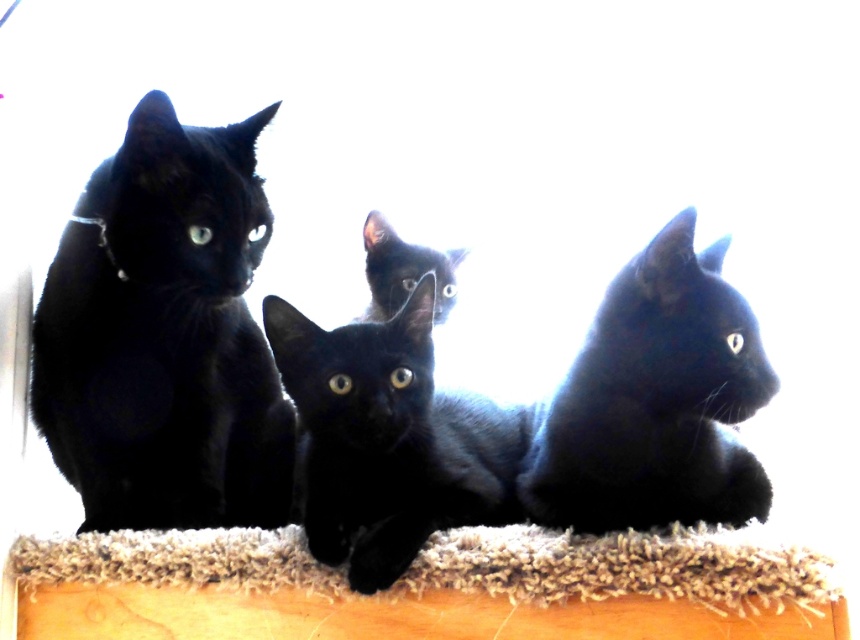
Question: Considering the real-world distances, which object is closest to the matte black cat at center?

Choices:
 (A) fuzzy carpet at lower center
 (B) shiny black cat at right
 (C) shiny black kitten at center
 (D) matte black cat at left

Answer: (C)

Question: Among these objects, which one is nearest to the camera?

Choices:
 (A) shiny black kitten at center
 (B) matte black cat at left
 (C) shiny black cat at right
 (D) fuzzy carpet at lower center

Answer: (D)

Question: Which of the following is the closest to the observer?

Choices:
 (A) (232, 307)
 (B) (796, 579)
 (C) (387, 554)
 (D) (716, 497)

Answer: (B)

Question: Is shiny black kitten at center behind matte black cat at center?

Choices:
 (A) no
 (B) yes

Answer: (A)

Question: Is fuzzy carpet at lower center above matte black cat at center?

Choices:
 (A) no
 (B) yes

Answer: (A)

Question: Can you confirm if matte black cat at left is positioned above shiny black kitten at center?

Choices:
 (A) yes
 (B) no

Answer: (A)